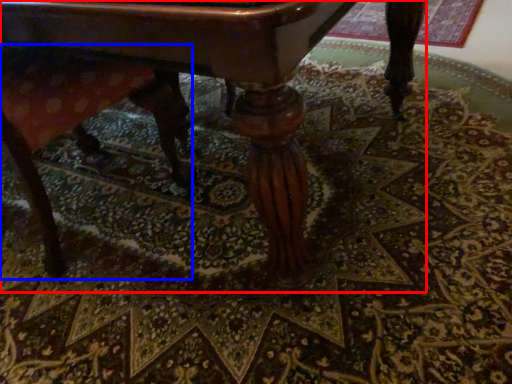
Question: Which of the following is the closest to the observer, table (highlighted by a red box) or swivel chair (highlighted by a blue box)?

Choices:
 (A) table
 (B) swivel chair

Answer: (A)